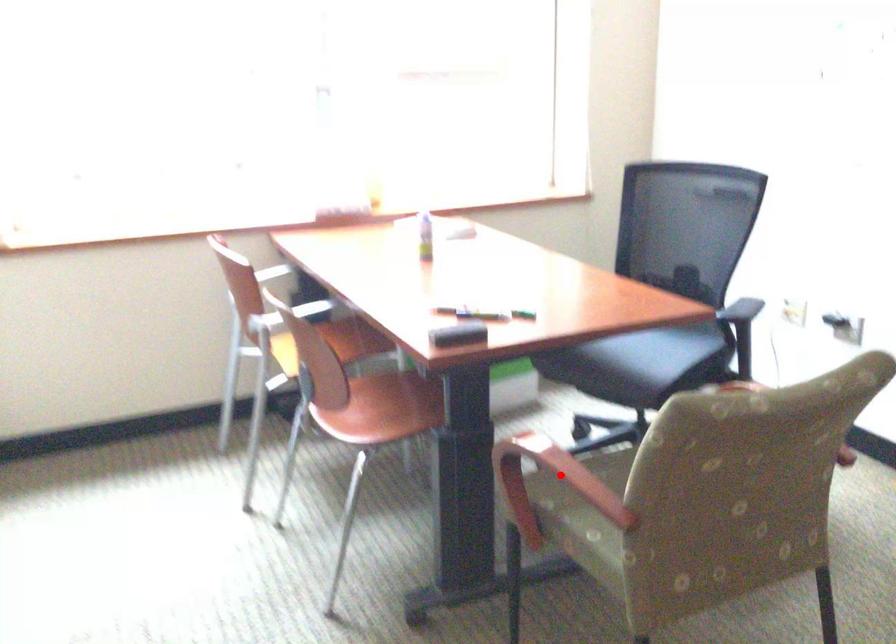
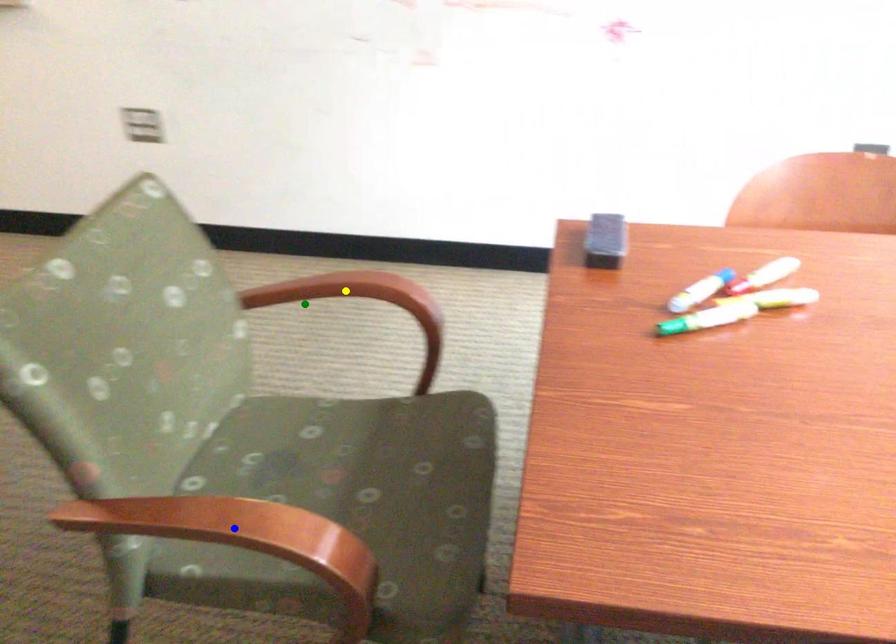
Question: I am providing you with two images of the same scene from different viewpoints. A red point is marked on the first image. You are given multiple points on the second image. Which point in image 2 represents the same 3d spot as the red point in image 1?

Choices:
 (A) blue point
 (B) green point
 (C) yellow point

Answer: (B)